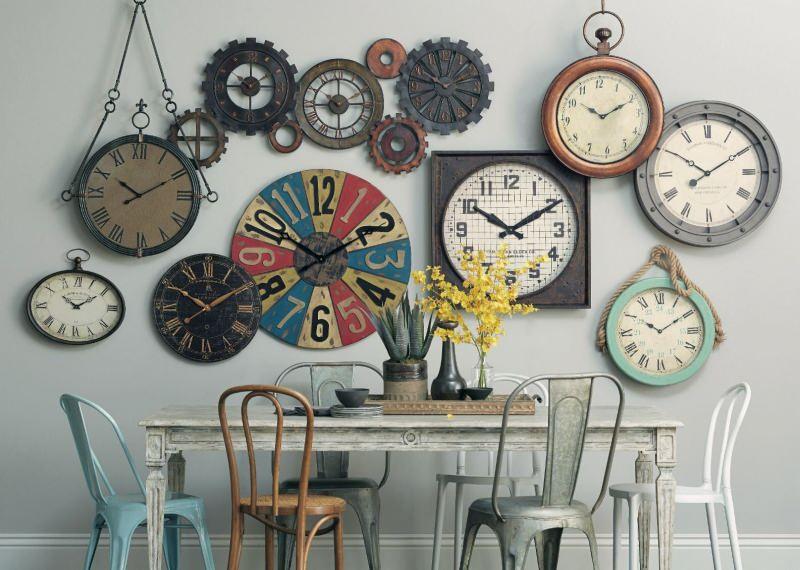
I want to click on chairs, so click(122, 517), click(282, 508), click(360, 487), click(456, 475), click(518, 522), click(698, 488).